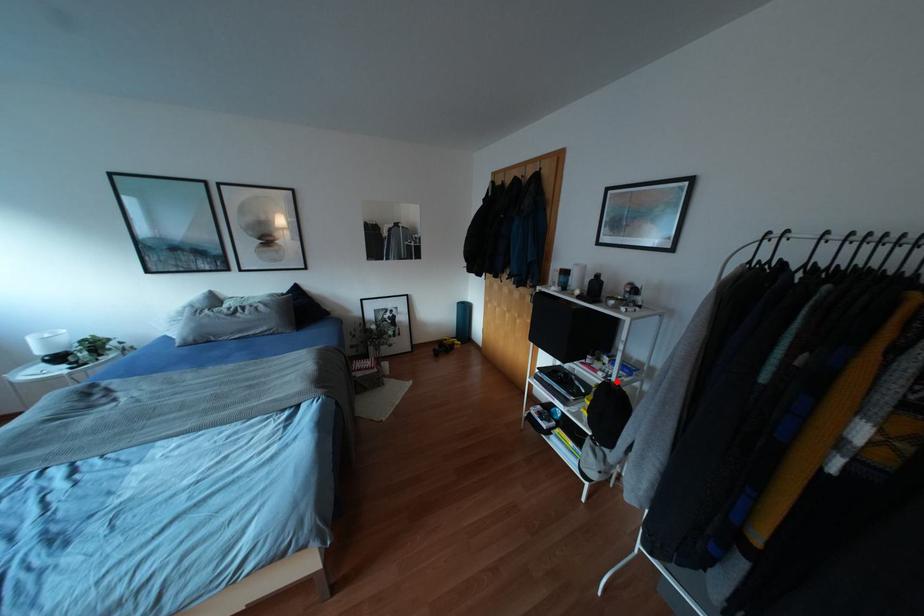
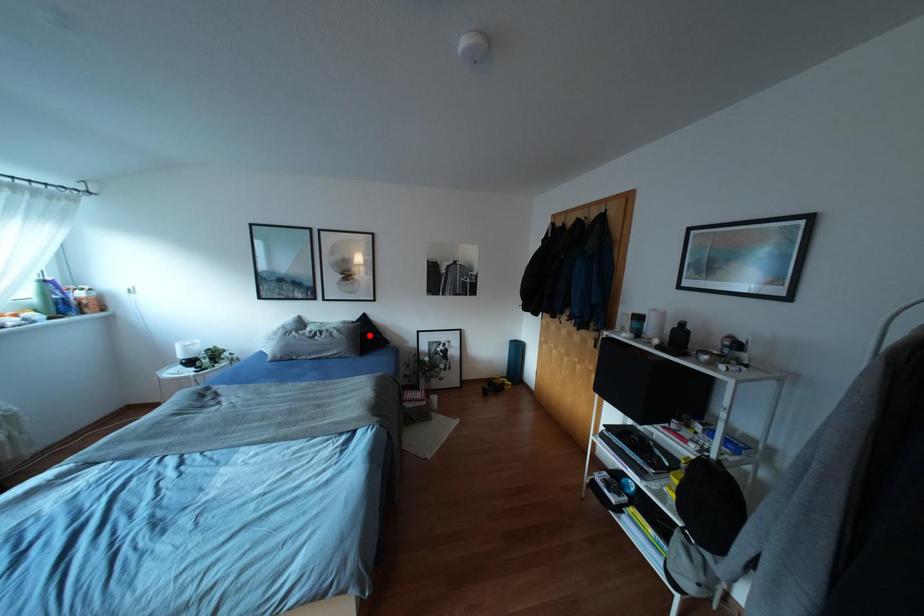
I am providing you with two images of the same scene from different viewpoints. A red point is marked on the first image and another point is marked on the second image. Are the points marked in image1 and image2 representing the same 3D position?

No